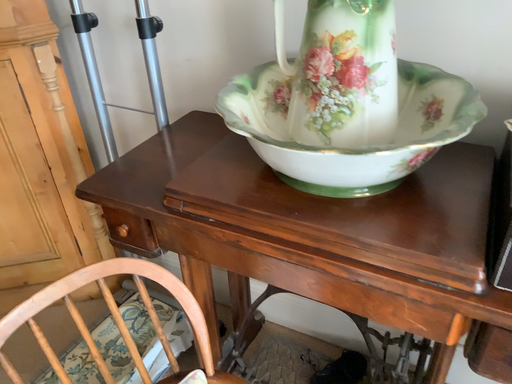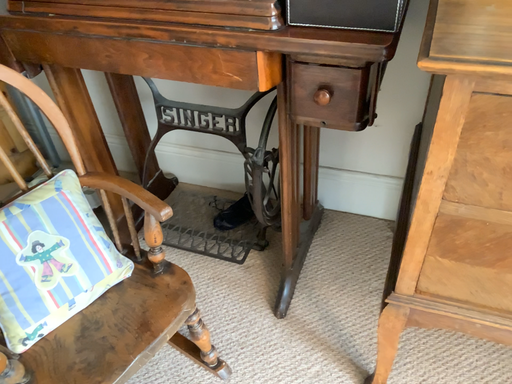
Question: How did the camera likely rotate when shooting the video?

Choices:
 (A) rotated upward
 (B) rotated downward

Answer: (B)